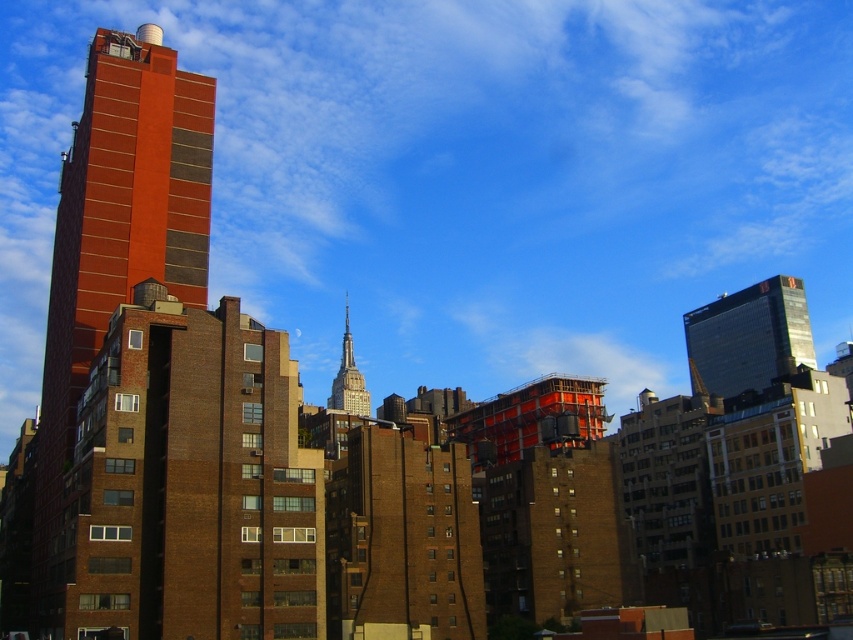
Question: Does brick building at left have a greater width compared to shiny glass skyscraper at upper right?

Choices:
 (A) no
 (B) yes

Answer: (A)

Question: From the image, what is the correct spatial relationship of brick building at left in relation to white glass spire at center?

Choices:
 (A) above
 (B) below

Answer: (A)

Question: Which point is farther to the camera?

Choices:
 (A) (715, 339)
 (B) (67, 419)
 (C) (340, 378)

Answer: (C)

Question: Which of the following is the closest to the observer?

Choices:
 (A) (349, 376)
 (B) (138, 124)

Answer: (B)

Question: Does brick building at left have a smaller size compared to shiny glass skyscraper at upper right?

Choices:
 (A) no
 (B) yes

Answer: (B)

Question: Estimate the real-world distances between objects in this image. Which object is farther from the brick building at left?

Choices:
 (A) shiny glass skyscraper at upper right
 (B) white glass spire at center

Answer: (B)